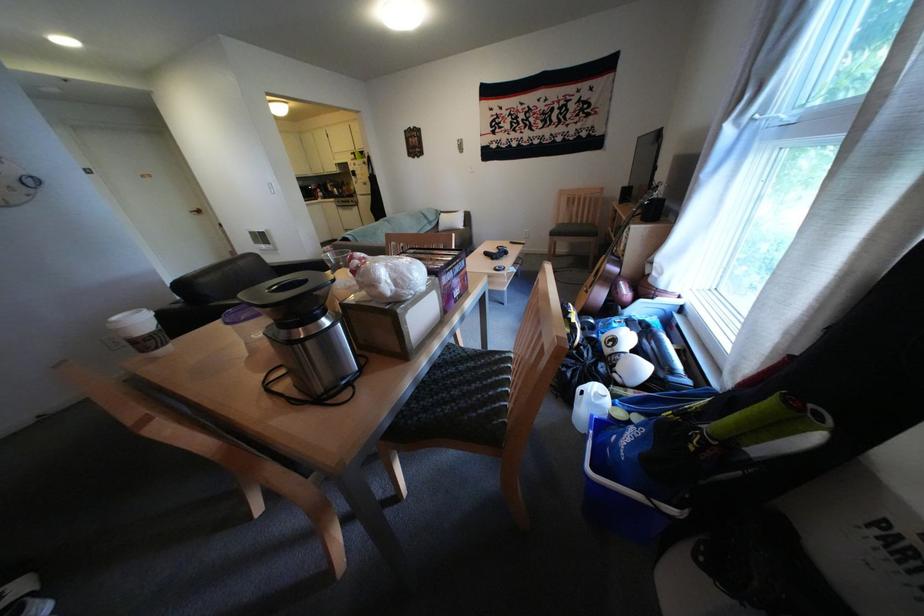
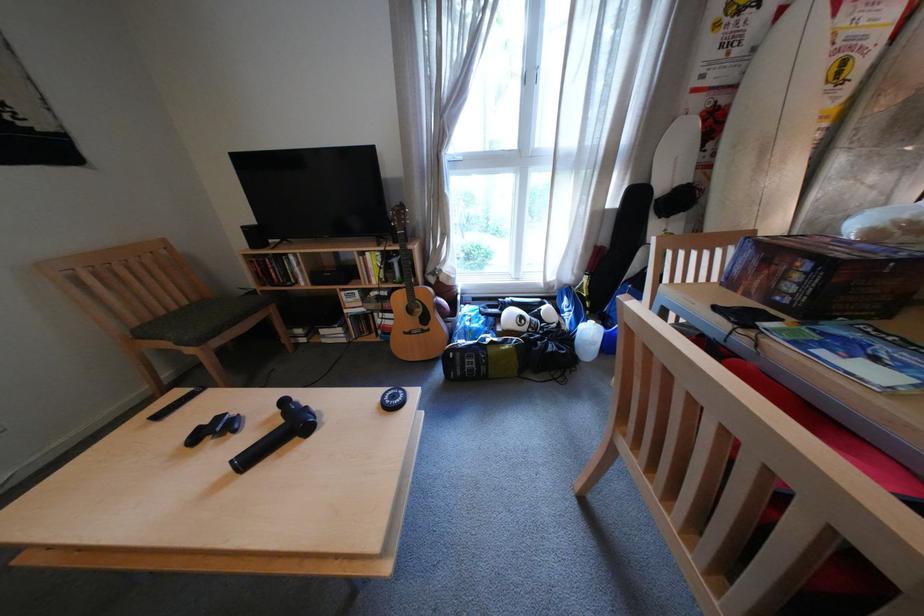
Where in the second image is the point corresponding to point (520, 254) from the first image?

(298, 403)